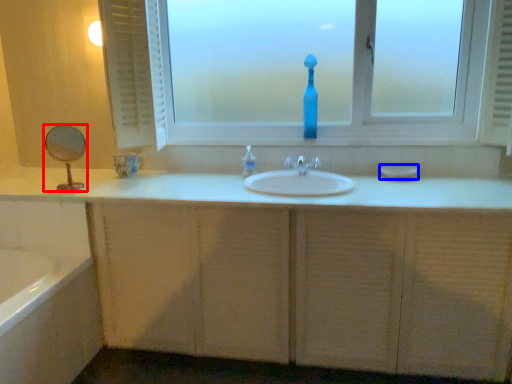
Question: Among these objects, which one is farthest to the camera, mirror (highlighted by a red box) or soap (highlighted by a blue box)?

Choices:
 (A) mirror
 (B) soap

Answer: (B)